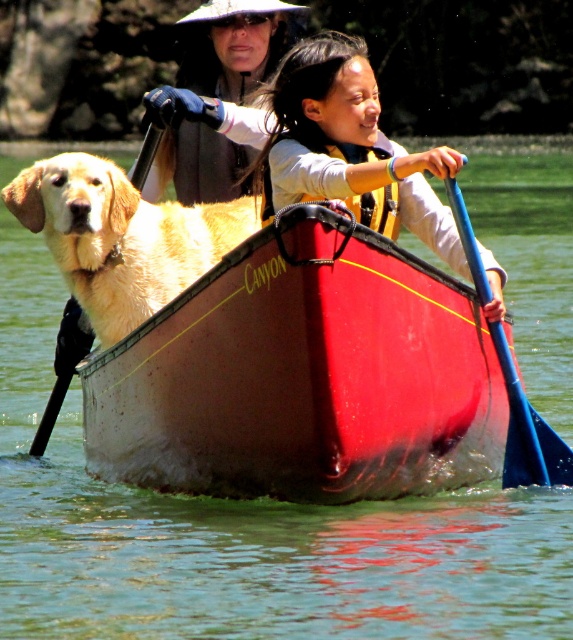
Is shiny red canoe at center thinner than matte black jacket at upper center?

Correct, shiny red canoe at center's width is less than matte black jacket at upper center's.

What do you see at coordinates (303, 376) in the screenshot?
I see `shiny red canoe at center` at bounding box center [303, 376].

Where is `shiny red canoe at center`? The height and width of the screenshot is (640, 573). shiny red canoe at center is located at coordinates (303, 376).

Is the position of matte black jacket at upper center more distant than that of blue plastic paddle at right?

Yes, it is behind blue plastic paddle at right.

Between matte black jacket at upper center and blue plastic paddle at right, which one appears on the left side from the viewer's perspective?

matte black jacket at upper center

Is point (206, 28) less distant than point (519, 448)?

No, it is behind (519, 448).

You are a GUI agent. You are given a task and a screenshot of the screen. Output one action in this format:
    pyautogui.click(x=<x>, y=<y>)
    Task: Click on the matte black jacket at upper center
    This screenshot has width=573, height=640.
    Given the screenshot: What is the action you would take?
    pyautogui.click(x=221, y=93)

Is point (261, 44) closer to camera compared to point (382, 220)?

No, it is behind (382, 220).

From the picture: Which is above, matte black jacket at upper center or yellow/yellowish fabric life jacket at center?

matte black jacket at upper center is higher up.

At what (x,y) coordinates should I click in order to perform the action: click on matte black jacket at upper center. Please return your answer as a coordinate pair (x, y). This screenshot has width=573, height=640. Looking at the image, I should click on [221, 93].

Where is `matte black jacket at upper center`? matte black jacket at upper center is located at coordinates (221, 93).